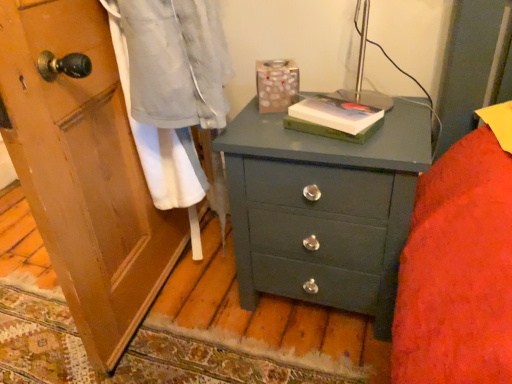
Question: Is hardcover book at center, marked as the 1th book in a bottom-to-top arrangement, bigger or smaller than hardcover book at center, acting as the 1th book starting from the top?

Choices:
 (A) big
 (B) small

Answer: (A)

Question: From the image's perspective, is hardcover book at center, marked as the 1th book in a bottom-to-top arrangement, located above or below hardcover book at center, which is the 2th book from bottom to top?

Choices:
 (A) below
 (B) above

Answer: (A)

Question: Based on their relative distances, which object is farther from the matte green chest of drawers at center?

Choices:
 (A) hardcover book at center, which is the 2th book from bottom to top
 (B) hardcover book at center, marked as the second book in a top-to-bottom arrangement

Answer: (B)

Question: Which object is the farthest from the matte green chest of drawers at center?

Choices:
 (A) hardcover book at center, marked as the second book in a top-to-bottom arrangement
 (B) hardcover book at center, acting as the 1th book starting from the top

Answer: (A)